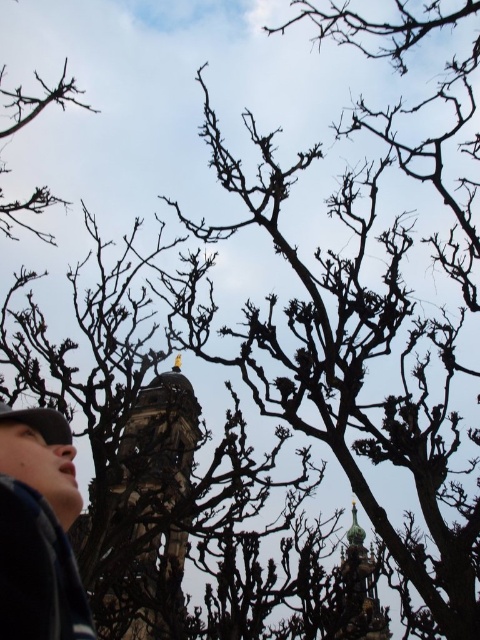
Question: Estimate the real-world distances between objects in this image. Which object is closer to the stone tower at center?

Choices:
 (A) dark blue jacket at lower left
 (B) green glazed tower at center

Answer: (A)

Question: Is dark blue jacket at lower left to the right of green glazed tower at center from the viewer's perspective?

Choices:
 (A) yes
 (B) no

Answer: (B)

Question: Among these points, which one is nearest to the camera?

Choices:
 (A) (348, 624)
 (B) (23, 628)

Answer: (B)

Question: Is stone tower at center above green glazed tower at center?

Choices:
 (A) no
 (B) yes

Answer: (B)

Question: Which point appears farthest from the camera in this image?

Choices:
 (A) (11, 525)
 (B) (167, 428)

Answer: (B)

Question: Is stone tower at center to the right of green glazed tower at center from the viewer's perspective?

Choices:
 (A) no
 (B) yes

Answer: (A)